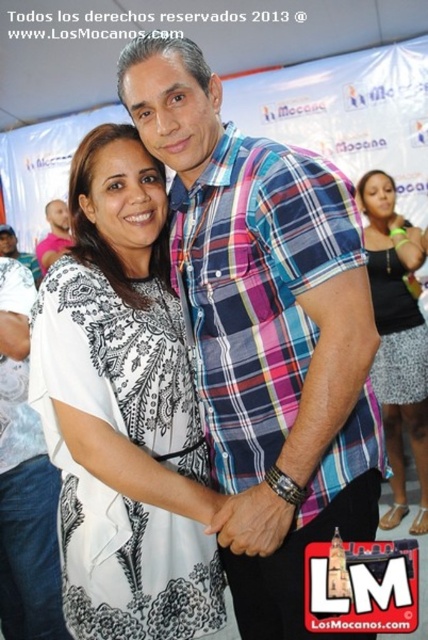
Question: Is plaid cotton shirt at center above white printed blouse at center?

Choices:
 (A) yes
 (B) no

Answer: (A)

Question: Which is farther from the plaid cotton shirt at center?

Choices:
 (A) black textured dress at right
 (B) white printed blouse at center

Answer: (A)

Question: Is plaid cotton shirt at center behind white printed blouse at center?

Choices:
 (A) no
 (B) yes

Answer: (A)

Question: Which object is closer to the camera taking this photo?

Choices:
 (A) white printed blouse at center
 (B) black textured dress at right
 (C) plaid cotton shirt at center

Answer: (C)

Question: Can you confirm if plaid cotton shirt at center is smaller than white printed blouse at center?

Choices:
 (A) no
 (B) yes

Answer: (A)

Question: Which of the following is the farthest from the observer?

Choices:
 (A) plaid cotton shirt at center
 (B) black textured dress at right
 (C) white printed blouse at center

Answer: (B)